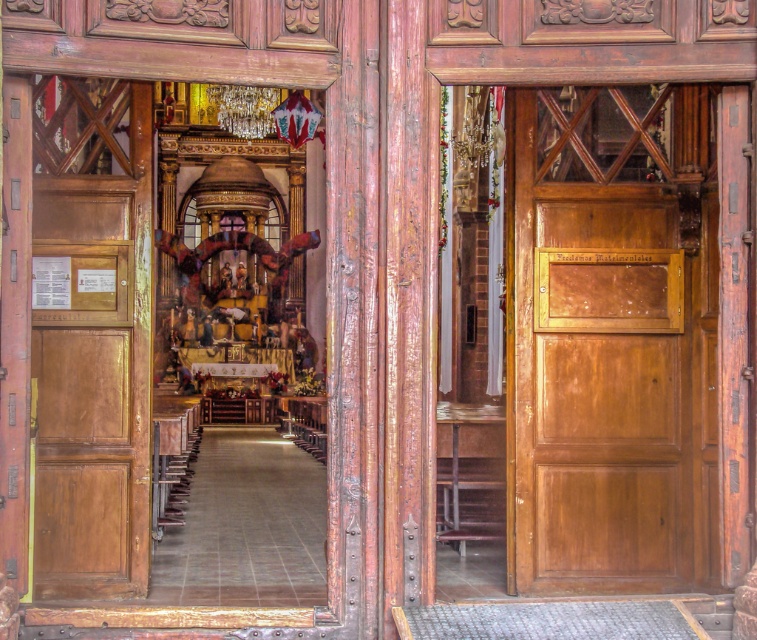
You are standing in front of two matte wood doors, the matte wood door at right and the matte wood door at left. Which door is closer to you?

The matte wood door at right is closer to you because it is further to the viewer than the matte wood door at left, meaning it is positioned nearer in the scene.

You are standing in front of the church door and want to take a photo of both point (678,128) and point (111,182) inside the church. Which point is closer to your camera lens?

Point (111,182) is closer to the camera lens because it is less further than point (678,128).

Looking at this image, you are standing in front of a church entrance and want to enter. The matte wood door at right is the only entrance available. Can you walk through it without any difficulty?

The matte wood door at right is 16.19 meters away from the viewer, which means it is too far away to walk through directly. You would need to move closer first.